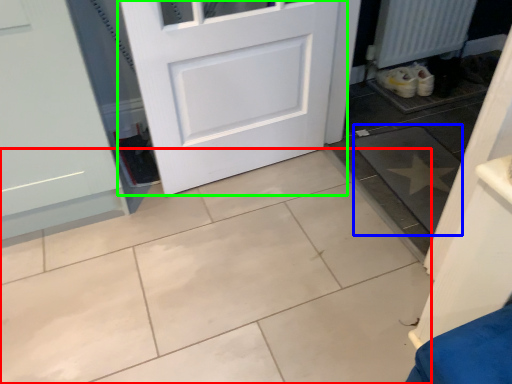
Question: Which object is positioned farthest from ceramic tile (highlighted by a red box)? Select from ceramic tile (highlighted by a blue box) and door (highlighted by a green box).

Choices:
 (A) ceramic tile
 (B) door

Answer: (A)